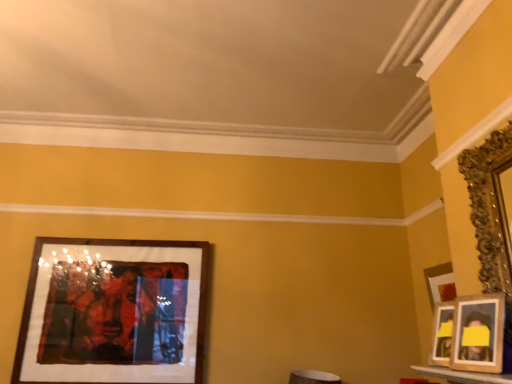
Question: Is gold ornate mirror at right, acting as the third picture frame starting from the back, located outside wooden photo frame at right, positioned as the 2th picture frame in right-to-left order?

Choices:
 (A) no
 (B) yes

Answer: (B)

Question: Does gold ornate mirror at right, acting as the third picture frame starting from the back, have a larger size compared to wooden photo frame at right, positioned as the 2th picture frame in right-to-left order?

Choices:
 (A) no
 (B) yes

Answer: (B)

Question: Is gold ornate mirror at right, acting as the third picture frame starting from the back, at the right side of wooden photo frame at right, arranged as the 2th picture frame when viewed from the back?

Choices:
 (A) yes
 (B) no

Answer: (A)

Question: Considering the relative sizes of gold ornate mirror at right, which is counted as the third picture frame, starting from the left, and wooden photo frame at right, positioned as the 2th picture frame in right-to-left order, in the image provided, is gold ornate mirror at right, which is counted as the third picture frame, starting from the left, taller than wooden photo frame at right, positioned as the 2th picture frame in right-to-left order,?

Choices:
 (A) no
 (B) yes

Answer: (B)

Question: Does gold ornate mirror at right, which is counted as the third picture frame, starting from the left, turn towards wooden photo frame at right, positioned as the 2th picture frame in right-to-left order?

Choices:
 (A) yes
 (B) no

Answer: (A)

Question: Is wooden frame at left, the 3th picture frame viewed from the front, in front of or behind gold ornate mirror at right, acting as the third picture frame starting from the back, in the image?

Choices:
 (A) front
 (B) behind

Answer: (B)

Question: Is wooden frame at left, which is the 1th picture frame from left to right, inside or outside of gold ornate mirror at right, which is the first picture frame in right-to-left order?

Choices:
 (A) outside
 (B) inside

Answer: (A)

Question: Considering the positions of wooden frame at left, the 3th picture frame viewed from the front, and gold ornate mirror at right, which is counted as the third picture frame, starting from the left, in the image, is wooden frame at left, the 3th picture frame viewed from the front, taller or shorter than gold ornate mirror at right, which is counted as the third picture frame, starting from the left,?

Choices:
 (A) tall
 (B) short

Answer: (A)

Question: Is wooden frame at left, which is the 1th picture frame from left to right, bigger or smaller than gold ornate mirror at right, which is counted as the third picture frame, starting from the left?

Choices:
 (A) small
 (B) big

Answer: (B)

Question: Is wooden frame at left, placed as the 3th picture frame when sorted from right to left, wider or thinner than wooden photo frame at right, arranged as the 2th picture frame when viewed from the back?

Choices:
 (A) wide
 (B) thin

Answer: (A)

Question: Is wooden frame at left, the 3th picture frame viewed from the front, bigger or smaller than wooden photo frame at right, which appears as the second picture frame when viewed from the front?

Choices:
 (A) big
 (B) small

Answer: (A)

Question: Is wooden frame at left, placed as the first picture frame when sorted from back to front, spatially inside wooden photo frame at right, the 2th picture frame positioned from the left, or outside of it?

Choices:
 (A) outside
 (B) inside

Answer: (A)

Question: From a real-world perspective, is wooden frame at left, the 3th picture frame viewed from the front, above or below wooden photo frame at right, arranged as the 2th picture frame when viewed from the back?

Choices:
 (A) above
 (B) below

Answer: (A)

Question: Considering the positions of wooden photo frame at right, positioned as the 2th picture frame in right-to-left order, and gold ornate mirror at right, which is the first picture frame in right-to-left order, in the image, is wooden photo frame at right, positioned as the 2th picture frame in right-to-left order, taller or shorter than gold ornate mirror at right, which is the first picture frame in right-to-left order,?

Choices:
 (A) short
 (B) tall

Answer: (A)

Question: From a real-world perspective, relative to gold ornate mirror at right, the first picture frame positioned from the front, is wooden photo frame at right, which appears as the second picture frame when viewed from the front, vertically above or below?

Choices:
 (A) below
 (B) above

Answer: (A)